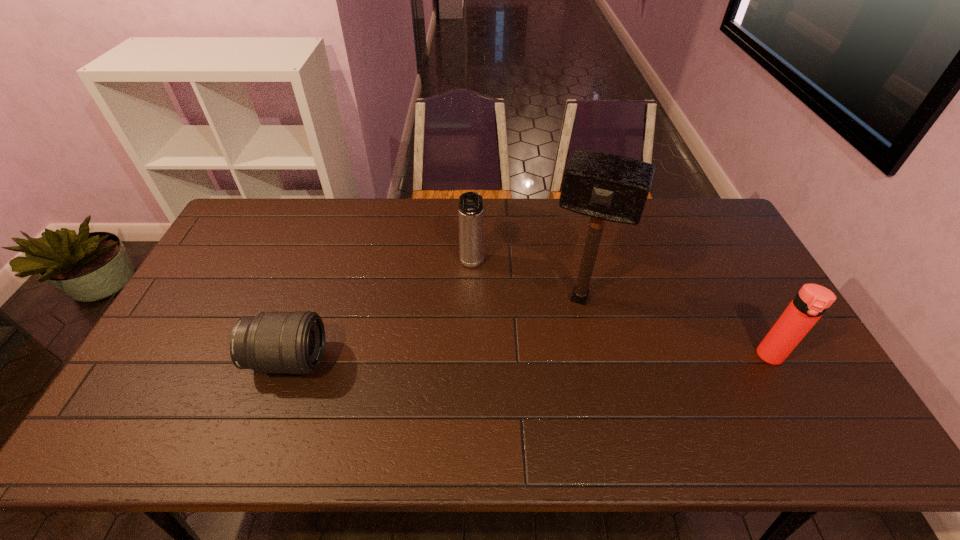
This screenshot has width=960, height=540. In order to click on free location at the left edge of the desktop in this screenshot , I will do `click(187, 323)`.

The height and width of the screenshot is (540, 960). Identify the location of blank area at the near left corner. (154, 404).

Locate an element on the screen. Image resolution: width=960 pixels, height=540 pixels. free location at the far right corner is located at coordinates (721, 229).

Where is `free area in between the rightmost object and the telephoto lens`? The width and height of the screenshot is (960, 540). free area in between the rightmost object and the telephoto lens is located at coordinates (529, 358).

Locate an element on the screen. free space between the farther thermos bottle and the telephoto lens is located at coordinates (380, 312).

The image size is (960, 540). I want to click on unoccupied position between the right thermos bottle and the mallet, so click(675, 327).

Locate an element on the screen. The width and height of the screenshot is (960, 540). empty space that is in between the shortest object and the third object from right to left is located at coordinates 380,312.

I want to click on unoccupied position between the farthest object and the rightmost object, so click(x=621, y=310).

Identify the location of free spot between the telephoto lens and the tallest object. The height and width of the screenshot is (540, 960). click(x=434, y=329).

You are a GUI agent. You are given a task and a screenshot of the screen. Output one action in this format:
    pyautogui.click(x=<x>, y=<y>)
    Task: Click on the unoccupied area between the third object from left to right and the right thermos bottle
    Image resolution: width=960 pixels, height=540 pixels.
    Given the screenshot: What is the action you would take?
    pyautogui.click(x=675, y=327)